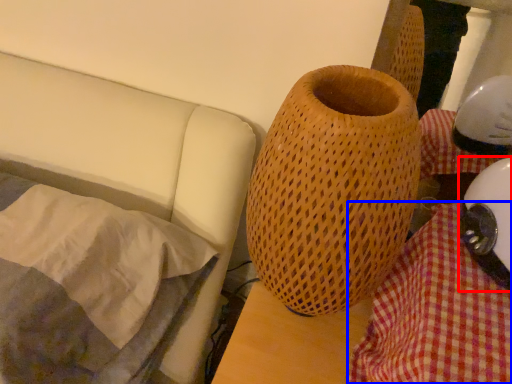
Question: Which point is closer to the camera, helmet (highlighted by a red box) or blanket (highlighted by a blue box)?

Choices:
 (A) helmet
 (B) blanket

Answer: (B)